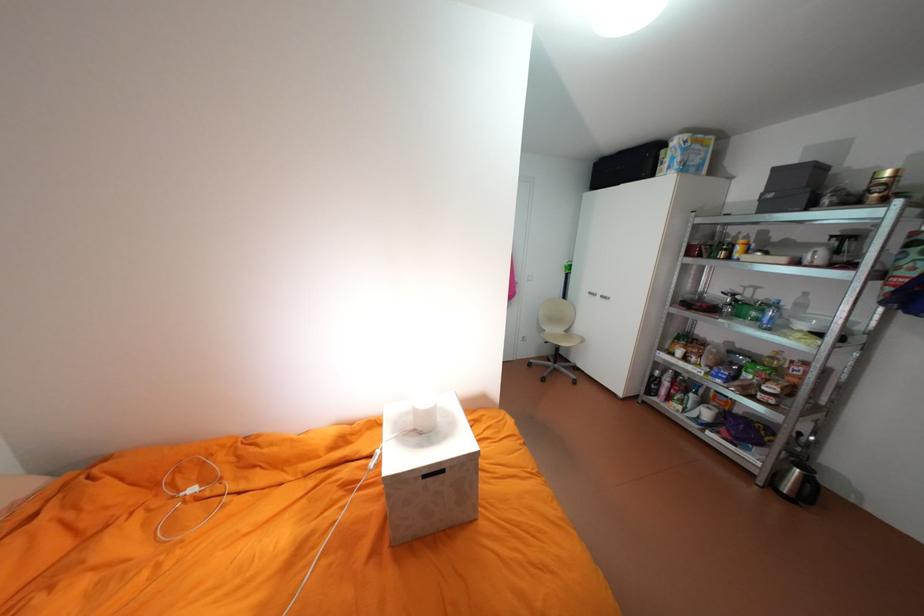
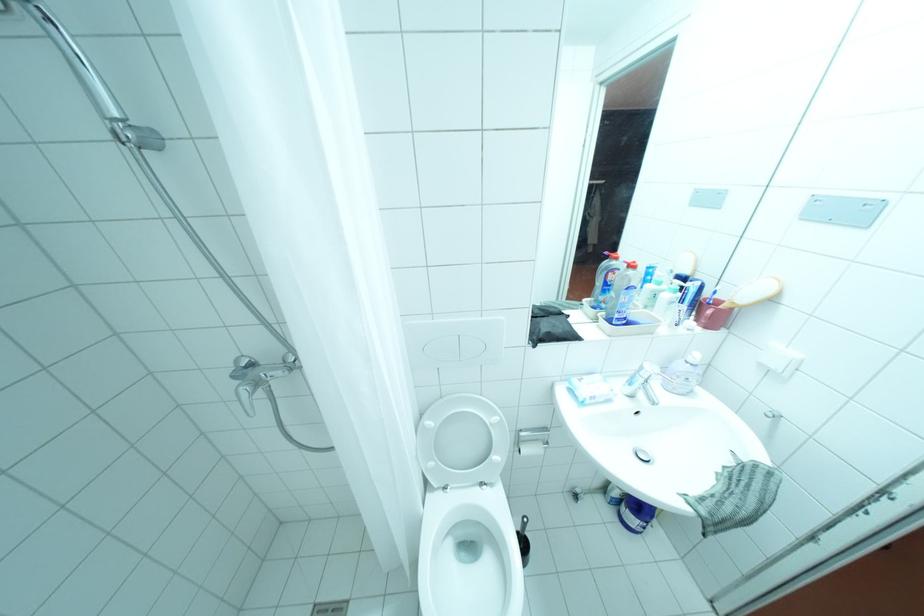
In the scene shown: What movement of the cameraman would produce the second image?

The cameraman walked toward left, forward.